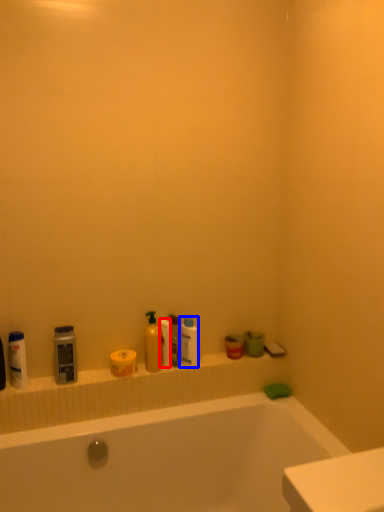
Question: Which point is further to the camera, toilet paper (highlighted by a red box) or toiletry (highlighted by a blue box)?

Choices:
 (A) toilet paper
 (B) toiletry

Answer: (B)